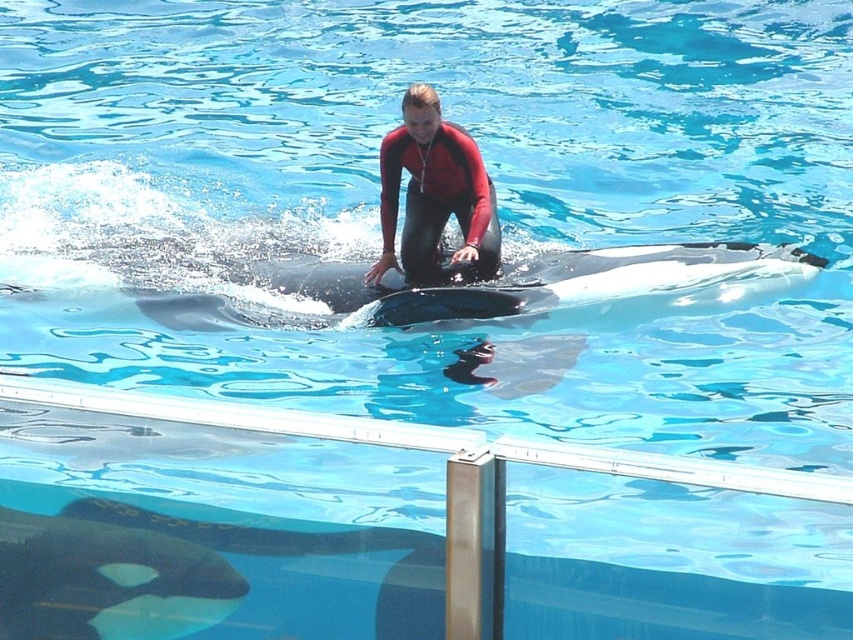
Which of these two, black smooth whale at center or red matte wetsuit at center, stands shorter?

black smooth whale at center

Can you confirm if black smooth whale at center is taller than red matte wetsuit at center?

No, black smooth whale at center is not taller than red matte wetsuit at center.

The height and width of the screenshot is (640, 853). Describe the element at coordinates (517, 288) in the screenshot. I see `black smooth whale at center` at that location.

This screenshot has width=853, height=640. Find the location of `black smooth whale at center`. black smooth whale at center is located at coordinates (517, 288).

Does black smooth whale at center come in front of black smooth whale at lower center?

No, black smooth whale at center is further to the viewer.

Between black smooth whale at center and black smooth whale at lower center, which one is positioned higher?

black smooth whale at center is higher up.

Is point (416, 316) more distant than point (119, 570)?

That is True.

Where is `black smooth whale at center`? This screenshot has width=853, height=640. black smooth whale at center is located at coordinates (517, 288).

Between black smooth whale at lower center and red matte wetsuit at center, which one is positioned lower?

black smooth whale at lower center is below.

Can you confirm if black smooth whale at lower center is shorter than red matte wetsuit at center?

Yes, black smooth whale at lower center is shorter than red matte wetsuit at center.

Which is in front, point (158, 557) or point (483, 186)?

Point (158, 557) is more forward.

Identify the location of black smooth whale at lower center. The image size is (853, 640). (106, 580).